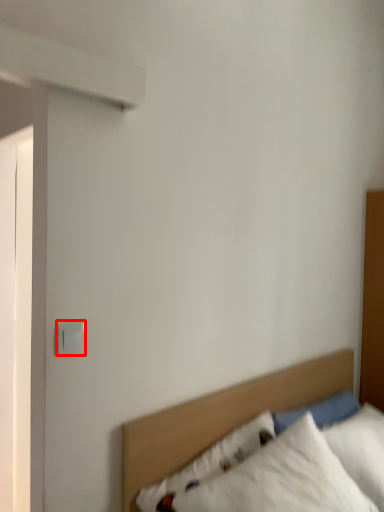
Question: From the image's perspective, considering the relative positions of electric outlet (annotated by the red box) and bed in the image provided, where is electric outlet (annotated by the red box) located with respect to the staircase?

Choices:
 (A) above
 (B) below

Answer: (A)